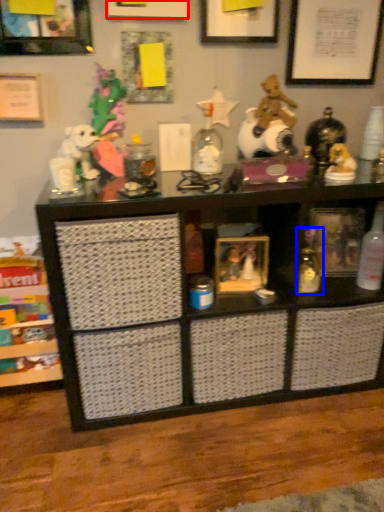
Question: Which point is further to the camera, picture frame (highlighted by a red box) or toy (highlighted by a blue box)?

Choices:
 (A) picture frame
 (B) toy

Answer: (B)